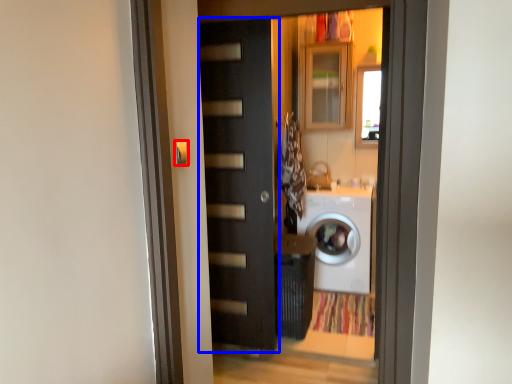
Question: Which object appears farthest to the camera in this image, door handle (highlighted by a red box) or door (highlighted by a blue box)?

Choices:
 (A) door handle
 (B) door

Answer: (B)